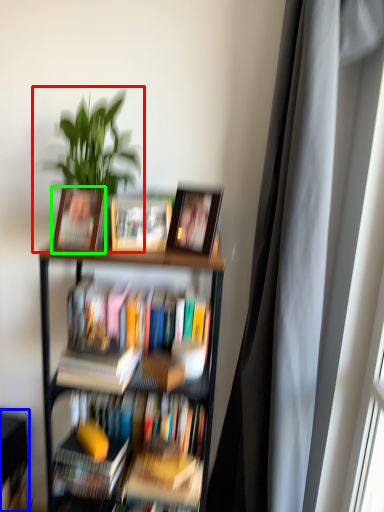
Question: Which is farther away from houseplant (highlighted by a red box)? shelf (highlighted by a blue box) or picture frame (highlighted by a green box)?

Choices:
 (A) shelf
 (B) picture frame

Answer: (A)